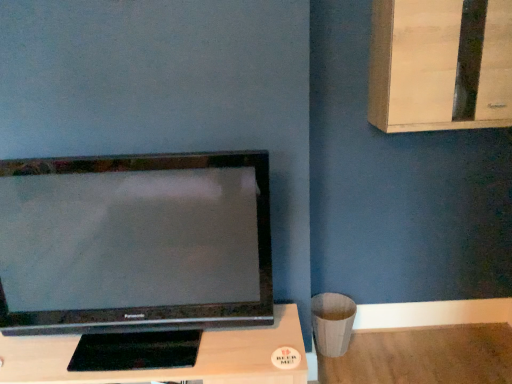
This screenshot has width=512, height=384. I want to click on light wood dresser at upper right, so click(440, 65).

What is the approximate width of light wood dresser at upper right?

12.93 inches.

Where is `light wood dresser at upper right`? This screenshot has width=512, height=384. light wood dresser at upper right is located at coordinates (440, 65).

Is black matte tv at center in front of satin black television at left?

No.

Which of these two, black matte tv at center or satin black television at left, is wider?

black matte tv at center.

Is black matte tv at center to the left of satin black television at left from the viewer's perspective?

No.

From the image's perspective, who appears lower, light wood dresser at upper right or black matte tv at center?

black matte tv at center.

Does point (472, 33) appear closer or farther from the camera than point (21, 351)?

Point (472, 33).

Can you confirm if light wood dresser at upper right is shorter than black matte tv at center?

No, light wood dresser at upper right is not shorter than black matte tv at center.

Between light wood dresser at upper right and black matte tv at center, which one has smaller size?

With smaller size is light wood dresser at upper right.

Can you confirm if satin black television at left is thinner than light wood dresser at upper right?

Yes, satin black television at left is thinner than light wood dresser at upper right.

From a real-world perspective, is satin black television at left positioned above or below light wood dresser at upper right?

satin black television at left is below light wood dresser at upper right.

Can you see satin black television at left touching light wood dresser at upper right?

No, satin black television at left is not with light wood dresser at upper right.

Considering the relative sizes of satin black television at left and light wood dresser at upper right in the image provided, is satin black television at left shorter than light wood dresser at upper right?

In fact, satin black television at left may be taller than light wood dresser at upper right.

From a real-world perspective, is light wood dresser at upper right positioned above or below satin black television at left?

Clearly, from a real-world perspective, light wood dresser at upper right is above satin black television at left.

Can you tell me how much light wood dresser at upper right and satin black television at left differ in facing direction?

They differ by 0.000376 degrees in their facing directions.

Where is `television that appears in front of the light wood dresser at upper right`? This screenshot has height=384, width=512. television that appears in front of the light wood dresser at upper right is located at coordinates (135, 252).

Considering the relative sizes of light wood dresser at upper right and satin black television at left in the image provided, is light wood dresser at upper right smaller than satin black television at left?

Indeed, light wood dresser at upper right has a smaller size compared to satin black television at left.

Does black matte tv at center appear on the left side of light wood dresser at upper right?

Yes.

Is black matte tv at center oriented towards light wood dresser at upper right?

No.

Is black matte tv at center positioned far away from light wood dresser at upper right?

Absolutely, black matte tv at center is distant from light wood dresser at upper right.

Considering the positions of objects black matte tv at center and light wood dresser at upper right in the image provided, who is in front, black matte tv at center or light wood dresser at upper right?

black matte tv at center is closer to the camera.

Which is in front, satin black television at left or black matte tv at center?

satin black television at left is more forward.

From a real-world perspective, who is located higher, satin black television at left or black matte tv at center?

In real-world perspective, satin black television at left is above.

The width and height of the screenshot is (512, 384). Find the location of `television that appears above the black matte tv at center (from a real-world perspective)`. television that appears above the black matte tv at center (from a real-world perspective) is located at coordinates (135, 252).

The height and width of the screenshot is (384, 512). Identify the location of television in front of the black matte tv at center. (135, 252).

This screenshot has width=512, height=384. Find the location of `dresser on the right of black matte tv at center`. dresser on the right of black matte tv at center is located at coordinates (440, 65).

From the image, which object appears to be nearer to light wood dresser at upper right, black matte tv at center or satin black television at left?

satin black television at left is positioned closer to the anchor light wood dresser at upper right.

From the image, which object appears to be farther from light wood dresser at upper right, satin black television at left or black matte tv at center?

Based on the image, black matte tv at center appears to be further to light wood dresser at upper right.

When comparing their distances from satin black television at left, does black matte tv at center or light wood dresser at upper right seem further?

Based on the image, light wood dresser at upper right appears to be further to satin black television at left.

Which object lies further to the anchor point black matte tv at center, satin black television at left or light wood dresser at upper right?

Among the two, light wood dresser at upper right is located further to black matte tv at center.

Considering their positions, is light wood dresser at upper right positioned further to satin black television at left than black matte tv at center?

light wood dresser at upper right is further to satin black television at left.

Which object lies nearer to the anchor point black matte tv at center, light wood dresser at upper right or satin black television at left?

Based on the image, satin black television at left appears to be nearer to black matte tv at center.

Identify the location of furniture between satin black television at left and light wood dresser at upper right in the horizontal direction. This screenshot has height=384, width=512. (169, 369).